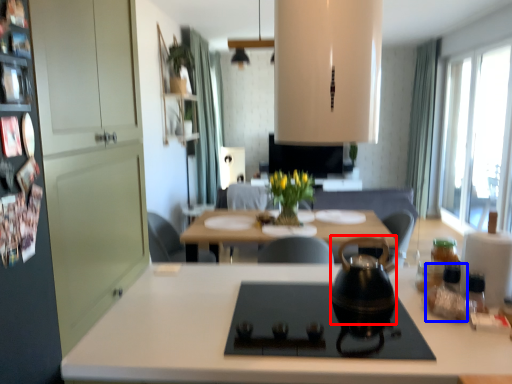
Question: Which object appears farthest to the camera in this image, tea pot (highlighted by a red box) or bottle (highlighted by a blue box)?

Choices:
 (A) tea pot
 (B) bottle

Answer: (B)